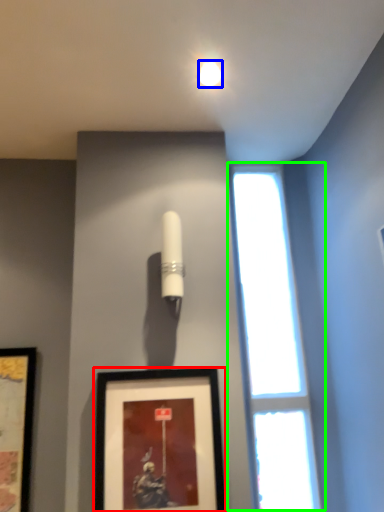
Question: Which is farther away from picture frame (highlighted by a red box)? lighting (highlighted by a blue box) or window (highlighted by a green box)?

Choices:
 (A) lighting
 (B) window

Answer: (A)